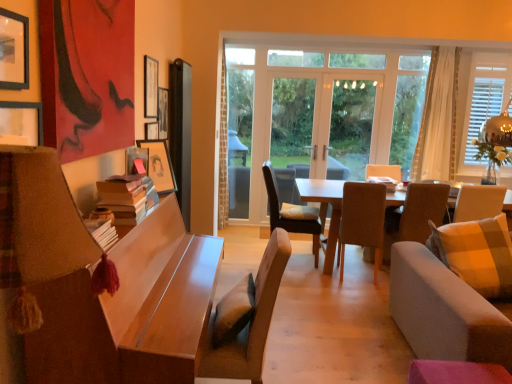
Question: Considering the positions of point (239, 367) and point (314, 238), is point (239, 367) closer or farther from the camera than point (314, 238)?

Choices:
 (A) closer
 (B) farther

Answer: (A)

Question: From the image's perspective, is light brown fabric chair at center, the first chair when ordered from front to back, positioned above or below brown fabric chair at center, which is the first chair in back-to-front order?

Choices:
 (A) above
 (B) below

Answer: (B)

Question: Estimate the real-world distances between objects in this image. Which object is closer to the wooden table at center, the 1th screen door when ordered from right to left?

Choices:
 (A) transparent glass window at center, the 1th window viewed from the left
 (B) white wooden window at right, arranged as the second window when viewed from the left
 (C) light brown fabric chair at center, the fourth chair in the right-to-left sequence
 (D) black matte picture frame at upper left, arranged as the 4th picture frame when viewed from the back
 (E) light gray fabric couch at right

Answer: (A)

Question: Which object is positioned closest to the light brown fabric chair at center, which appears as the 1th chair when viewed from the left?

Choices:
 (A) matte wooden picture frame at upper left, the second picture frame when ordered from front to back
 (B) wooden picture frame at upper center, placed as the 3th picture frame when sorted from front to back
 (C) wooden picture frame at upper center, positioned as the fourth picture frame in front-to-back order
 (D) light gray fabric couch at right
 (E) wooden table at left, which ranks as the first table in left-to-right order

Answer: (E)